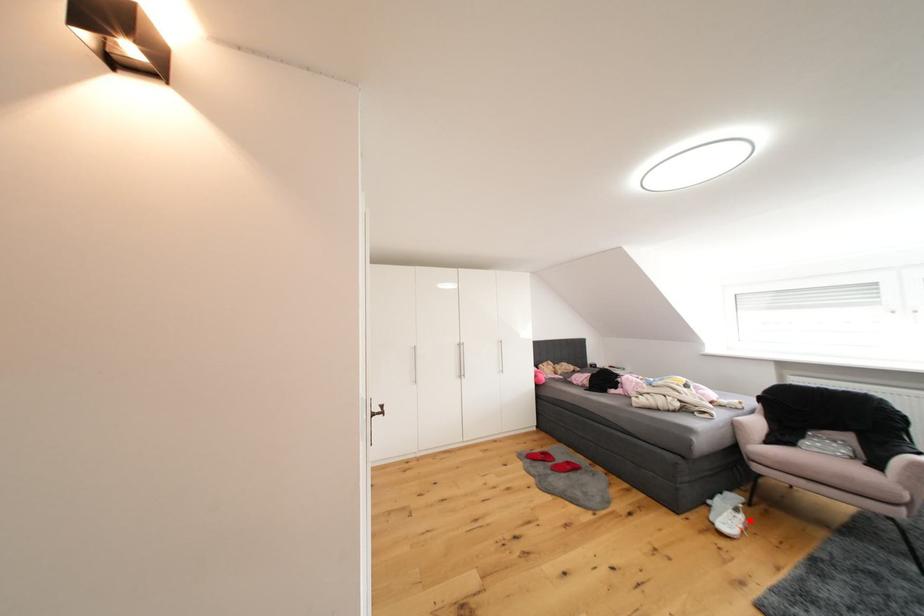
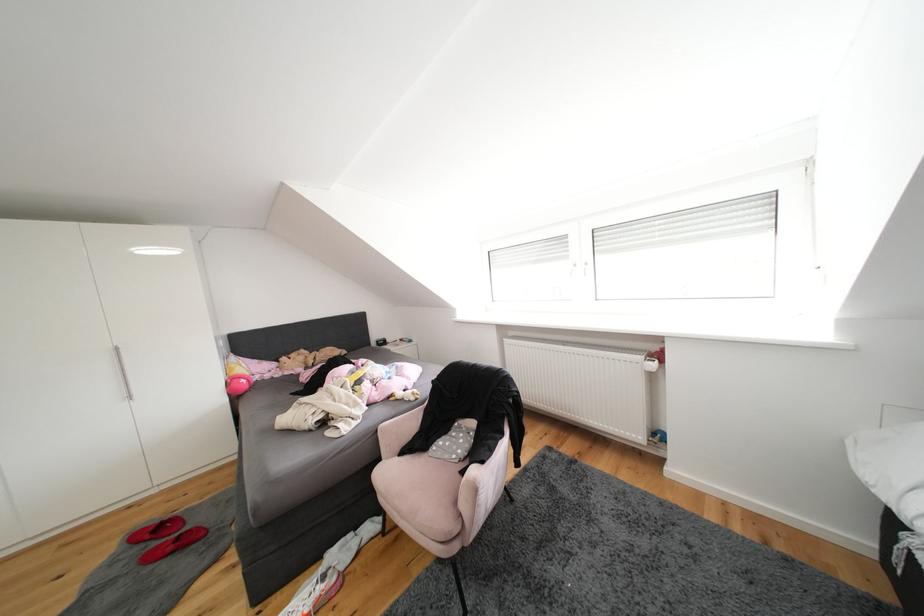
Locate, in the second image, the point that corresponds to the highlighted location in the first image.

(331, 592)